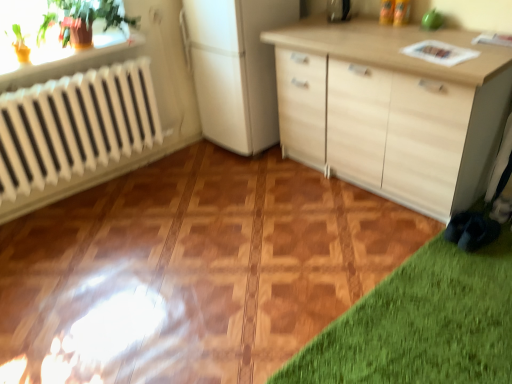
Question: Is green glossy plant at upper left in front of metallic silver toaster at upper center?

Choices:
 (A) no
 (B) yes

Answer: (B)

Question: Is green glossy plant at upper left in contact with metallic silver toaster at upper center?

Choices:
 (A) yes
 (B) no

Answer: (B)

Question: Can you confirm if green glossy plant at upper left is smaller than metallic silver toaster at upper center?

Choices:
 (A) no
 (B) yes

Answer: (A)

Question: From the image's perspective, would you say green glossy plant at upper left is shown under metallic silver toaster at upper center?

Choices:
 (A) yes
 (B) no

Answer: (A)

Question: Can you confirm if green glossy plant at upper left is bigger than metallic silver toaster at upper center?

Choices:
 (A) yes
 (B) no

Answer: (A)

Question: Is green glossy plant at upper left thinner than metallic silver toaster at upper center?

Choices:
 (A) yes
 (B) no

Answer: (B)

Question: From the image's perspective, is metallic silver toaster at upper center on green glossy plant at upper left?

Choices:
 (A) no
 (B) yes

Answer: (B)

Question: Is metallic silver toaster at upper center oriented away from green glossy plant at upper left?

Choices:
 (A) yes
 (B) no

Answer: (B)

Question: Is metallic silver toaster at upper center completely or partially outside of green glossy plant at upper left?

Choices:
 (A) yes
 (B) no

Answer: (A)

Question: Does metallic silver toaster at upper center have a larger size compared to green glossy plant at upper left?

Choices:
 (A) yes
 (B) no

Answer: (B)

Question: Is metallic silver toaster at upper center to the left of green glossy plant at upper left from the viewer's perspective?

Choices:
 (A) yes
 (B) no

Answer: (B)

Question: Is metallic silver toaster at upper center beside green glossy plant at upper left?

Choices:
 (A) yes
 (B) no

Answer: (B)

Question: From the image's perspective, is green glossy plant at upper left positioned above or below metallic silver toaster at upper center?

Choices:
 (A) below
 (B) above

Answer: (A)